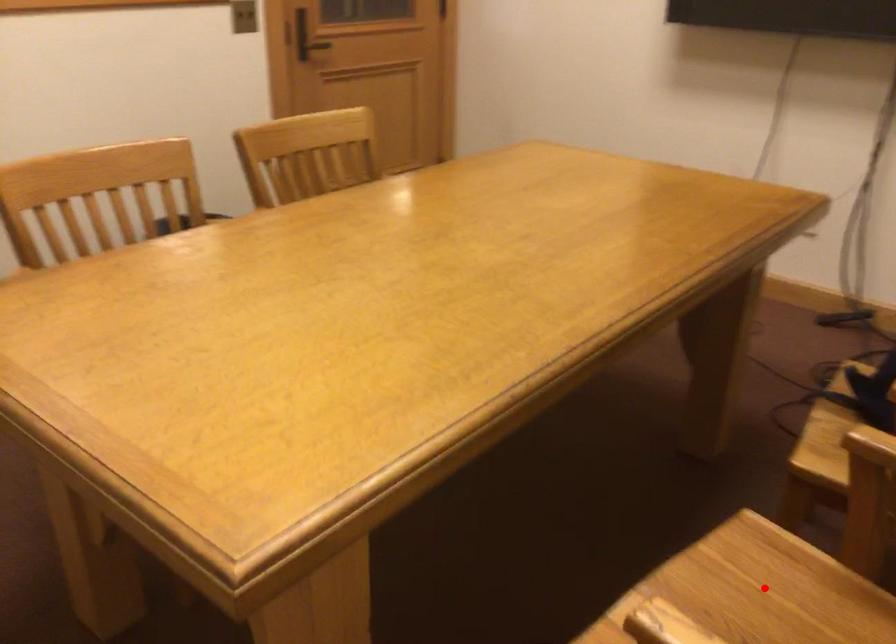
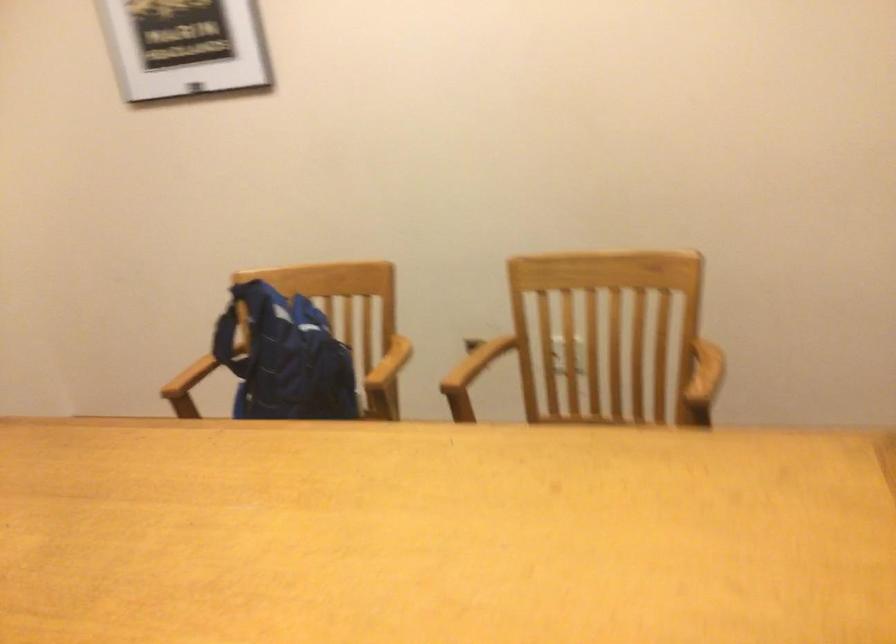
Question: I am providing you with two images of the same scene from different viewpoints. A red point is marked on the first image. Is the red point's position out of view in image 2?

Choices:
 (A) Yes
 (B) No

Answer: (A)